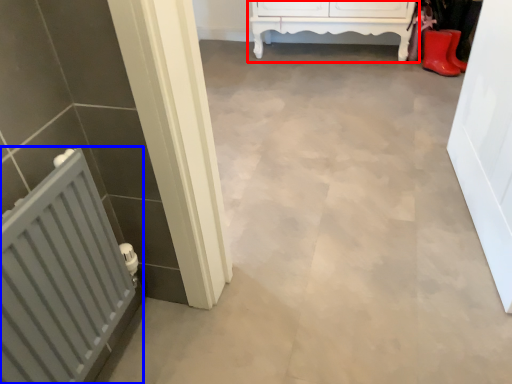
Question: Which point is further to the camera, furniture (highlighted by a red box) or radiator (highlighted by a blue box)?

Choices:
 (A) furniture
 (B) radiator

Answer: (A)